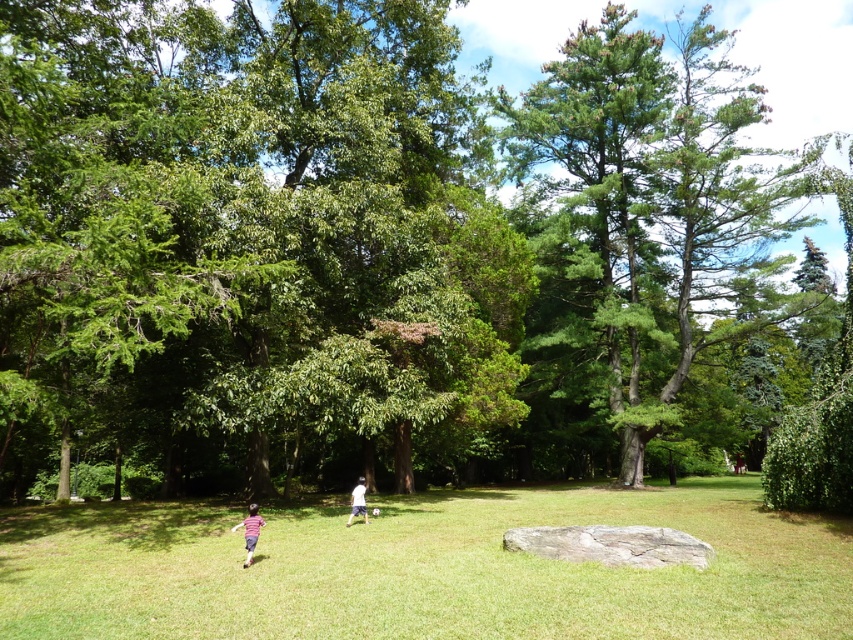
Question: Can you confirm if green grassy field at center is positioned below striped shirt at lower left?

Choices:
 (A) no
 (B) yes

Answer: (B)

Question: Is green needle-like tree at upper right above striped shirt at lower left?

Choices:
 (A) no
 (B) yes

Answer: (B)

Question: Does green grassy field at center appear on the left side of striped shirt at lower left?

Choices:
 (A) yes
 (B) no

Answer: (B)

Question: Which is farther from the green grassy field at center?

Choices:
 (A) striped shirt at lower left
 (B) green needle-like tree at upper right
 (C) white cotton shirt at center

Answer: (B)

Question: Which object appears farthest from the camera in this image?

Choices:
 (A) green grassy field at center
 (B) striped shirt at lower left

Answer: (B)

Question: Which object is farther from the camera taking this photo?

Choices:
 (A) green grassy field at center
 (B) striped shirt at lower left
 (C) white cotton shirt at center

Answer: (C)